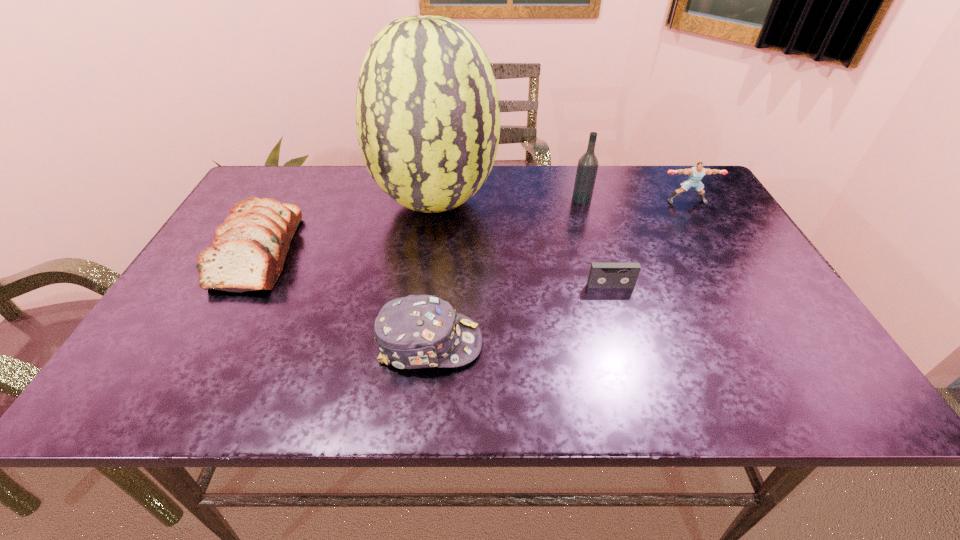
At what (x,y) coordinates should I click in order to perform the action: click on vacant area situated on the front-facing side of the nearest object. Please return your answer as a coordinate pair (x, y). Looking at the image, I should click on (665, 343).

The height and width of the screenshot is (540, 960). I want to click on vacant region located 0.110m on the front-facing side of the videotape, so click(622, 326).

The height and width of the screenshot is (540, 960). What are the coordinates of `watermelon at the far edge` in the screenshot? It's located at (427, 107).

Locate an element on the screen. vodka located at the far edge is located at coordinates (587, 167).

What are the coordinates of `puncher that is at the far edge` in the screenshot? It's located at (696, 173).

Image resolution: width=960 pixels, height=540 pixels. I want to click on bread that is positioned at the far edge, so click(x=249, y=249).

The image size is (960, 540). In order to click on object positioned at the near edge in this screenshot , I will do `click(417, 331)`.

You are a GUI agent. You are given a task and a screenshot of the screen. Output one action in this format:
    pyautogui.click(x=<x>, y=<y>)
    Task: Click on the object positioned at the left edge
    
    Given the screenshot: What is the action you would take?
    pyautogui.click(x=249, y=249)

You are a GUI agent. You are given a task and a screenshot of the screen. Output one action in this format:
    pyautogui.click(x=<x>, y=<y>)
    Task: Click on the object located at the right edge
    
    Given the screenshot: What is the action you would take?
    pyautogui.click(x=696, y=173)

The width and height of the screenshot is (960, 540). I want to click on object positioned at the far left corner, so click(x=249, y=249).